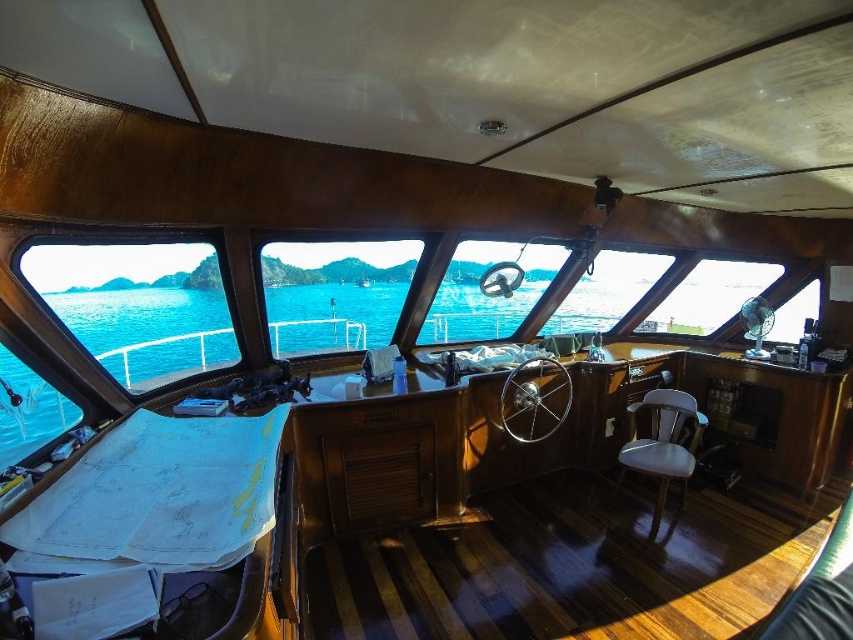
Question: Is blue water at center below transparent glass window at center?

Choices:
 (A) no
 (B) yes

Answer: (B)

Question: Estimate the real-world distances between objects in this image. Which object is closer to the white leather chair at lower right?

Choices:
 (A) transparent glass window at left
 (B) blue water at center

Answer: (B)

Question: Can you confirm if blue water at center is wider than white leather chair at lower right?

Choices:
 (A) yes
 (B) no

Answer: (B)

Question: Which of the following is the closest to the observer?

Choices:
 (A) (648, 474)
 (B) (378, 298)
 (C) (115, 378)
 (D) (170, 269)

Answer: (D)

Question: Which object is farther from the camera taking this photo?

Choices:
 (A) transparent glass window at center
 (B) white leather chair at lower right

Answer: (B)

Question: Can you confirm if blue water at center is positioned above white leather chair at lower right?

Choices:
 (A) no
 (B) yes

Answer: (B)